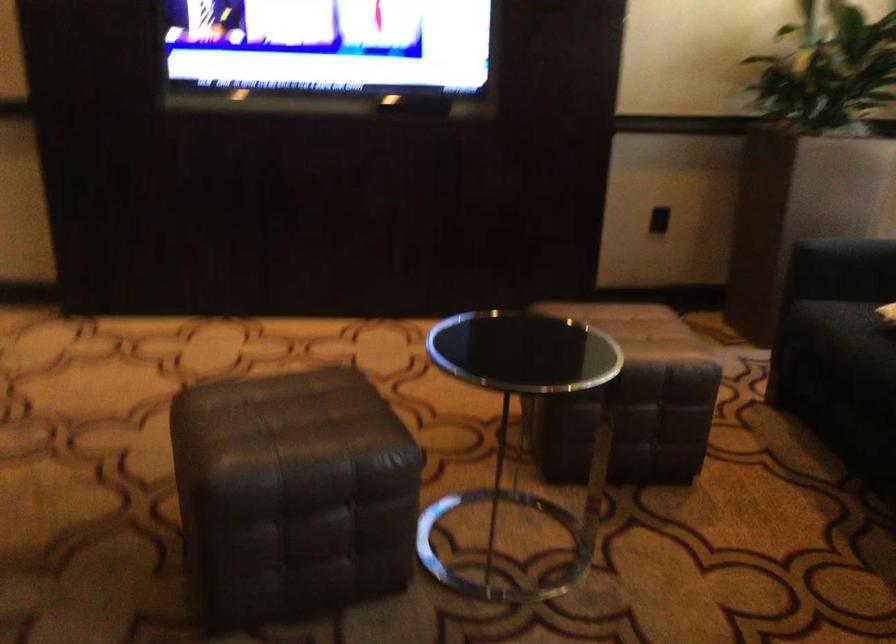
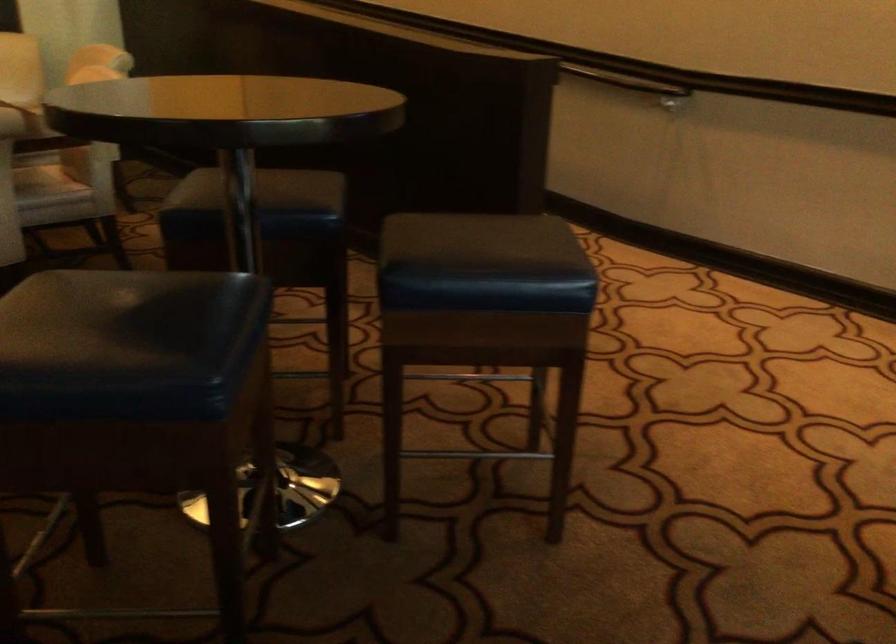
Question: The camera is either moving clockwise (left) or counter-clockwise (right) around the object. The first image is from the beginning of the video and the second image is from the end. Is the camera moving left or right when shooting the video?

Choices:
 (A) Left
 (B) Right

Answer: (B)